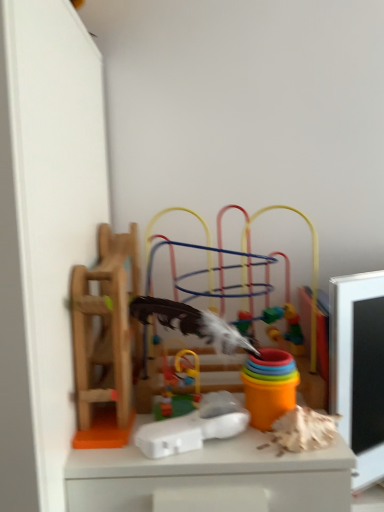
Image resolution: width=384 pixels, height=512 pixels. Describe the element at coordinates (194, 426) in the screenshot. I see `white plastic toy at center, which ranks as the third toy in left-to-right order` at that location.

Where is `white plastic toy at center, which ranks as the third toy in left-to-right order`? This screenshot has height=512, width=384. white plastic toy at center, which ranks as the third toy in left-to-right order is located at coordinates (194, 426).

Is rubberized plastic toy at center, which is the third toy from right to left, not near multicolored plastic toy at center, the first toy viewed from the right?

No, there isn't a large distance between rubberized plastic toy at center, which is the third toy from right to left, and multicolored plastic toy at center, the first toy viewed from the right.

Is rubberized plastic toy at center, which is the third toy from right to left, facing away from multicolored plastic toy at center, the first toy viewed from the right?

Yes, rubberized plastic toy at center, which is the third toy from right to left, is positioned with its back facing multicolored plastic toy at center, the first toy viewed from the right.

Which of these two, rubberized plastic toy at center, which is the third toy from right to left, or multicolored plastic toy at center, the first toy viewed from the right, is wider?

multicolored plastic toy at center, the first toy viewed from the right.

Who is more distant, rubberized plastic toy at center, which is the third toy from right to left, or multicolored plastic toy at center, acting as the 4th toy starting from the left?

multicolored plastic toy at center, acting as the 4th toy starting from the left, is further from the camera.

From the image's perspective, which is below, white plastic toy at center, which ranks as the 2th toy in right-to-left order, or multicolored plastic toy at center, acting as the 4th toy starting from the left?

white plastic toy at center, which ranks as the 2th toy in right-to-left order.

Can you confirm if white plastic toy at center, which ranks as the 2th toy in right-to-left order, is smaller than multicolored plastic toy at center, acting as the 4th toy starting from the left?

Correct, white plastic toy at center, which ranks as the 2th toy in right-to-left order, occupies less space than multicolored plastic toy at center, acting as the 4th toy starting from the left.

You are a GUI agent. You are given a task and a screenshot of the screen. Output one action in this format:
    pyautogui.click(x=<x>, y=<y>)
    Task: Click on the toy on the right of white plastic toy at center, which ranks as the 2th toy in right-to-left order
    The image size is (384, 512).
    Given the screenshot: What is the action you would take?
    pyautogui.click(x=106, y=342)

Is white plastic toy at center, which ranks as the third toy in left-to-right order, closer to the viewer compared to multicolored plastic toy at center, the first toy viewed from the right?

That is True.

You are a GUI agent. You are given a task and a screenshot of the screen. Output one action in this format:
    pyautogui.click(x=<x>, y=<y>)
    Task: Click on the toy located in front of the wooden ladder at left, which is the fourth toy from right to left
    Image resolution: width=384 pixels, height=512 pixels.
    Given the screenshot: What is the action you would take?
    pyautogui.click(x=194, y=426)

Would you say wooden ladder at left, placed as the 1th toy when sorted from left to right, is outside white plastic toy at center, which ranks as the third toy in left-to-right order?

Absolutely, wooden ladder at left, placed as the 1th toy when sorted from left to right, is external to white plastic toy at center, which ranks as the third toy in left-to-right order.

How many degrees apart are the facing directions of wooden ladder at left, placed as the 1th toy when sorted from left to right, and white plastic toy at center, which ranks as the third toy in left-to-right order?

The angular difference between wooden ladder at left, placed as the 1th toy when sorted from left to right, and white plastic toy at center, which ranks as the third toy in left-to-right order, is 17.5 degrees.

Which is more to the right, wooden ladder at left, placed as the 1th toy when sorted from left to right, or white plastic toy at center, which ranks as the third toy in left-to-right order?

white plastic toy at center, which ranks as the third toy in left-to-right order.

Who is smaller, multicolored plastic toy at center, the first toy viewed from the right, or rubberized plastic toy at center, which appears as the 2th toy when viewed from the left?

With smaller size is rubberized plastic toy at center, which appears as the 2th toy when viewed from the left.

This screenshot has height=512, width=384. In order to click on the 2nd toy below the multicolored plastic toy at center, the first toy viewed from the right (from the image's perspective) in this screenshot , I will do `click(179, 386)`.

Is multicolored plastic toy at center, the first toy viewed from the right, oriented away from rubberized plastic toy at center, which is the third toy from right to left?

That's not correct — multicolored plastic toy at center, the first toy viewed from the right, is not looking away from rubberized plastic toy at center, which is the third toy from right to left.

Is multicolored plastic toy at center, acting as the 4th toy starting from the left, surrounding rubberized plastic toy at center, which appears as the 2th toy when viewed from the left?

No.

You are a GUI agent. You are given a task and a screenshot of the screen. Output one action in this format:
    pyautogui.click(x=<x>, y=<y>)
    Task: Click on the 2nd toy behind when counting from the wooden ladder at left, which is the fourth toy from right to left
    The width and height of the screenshot is (384, 512).
    Given the screenshot: What is the action you would take?
    pyautogui.click(x=106, y=342)

Between wooden ladder at left, which is the fourth toy from right to left, and multicolored plastic toy at center, acting as the 4th toy starting from the left, which one has more height?

multicolored plastic toy at center, acting as the 4th toy starting from the left, is taller.

Can you confirm if wooden ladder at left, placed as the 1th toy when sorted from left to right, is bigger than multicolored plastic toy at center, the first toy viewed from the right?

No.

Do you think wooden ladder at left, placed as the 1th toy when sorted from left to right, is within multicolored plastic toy at center, acting as the 4th toy starting from the left, or outside of it?

wooden ladder at left, placed as the 1th toy when sorted from left to right, lies outside multicolored plastic toy at center, acting as the 4th toy starting from the left.

Could you measure the distance between white plastic toy at center, which ranks as the third toy in left-to-right order, and rubberized plastic toy at center, which appears as the 2th toy when viewed from the left?

A distance of 1.85 inches exists between white plastic toy at center, which ranks as the third toy in left-to-right order, and rubberized plastic toy at center, which appears as the 2th toy when viewed from the left.

From the image's perspective, between white plastic toy at center, which ranks as the third toy in left-to-right order, and rubberized plastic toy at center, which is the third toy from right to left, which one is located above?

rubberized plastic toy at center, which is the third toy from right to left, from the image's perspective.

Considering the sizes of objects white plastic toy at center, which ranks as the 2th toy in right-to-left order, and rubberized plastic toy at center, which is the third toy from right to left, in the image provided, who is smaller, white plastic toy at center, which ranks as the 2th toy in right-to-left order, or rubberized plastic toy at center, which is the third toy from right to left,?

white plastic toy at center, which ranks as the 2th toy in right-to-left order, is smaller.

Is white plastic toy at center, which ranks as the 2th toy in right-to-left order, in front of or behind rubberized plastic toy at center, which appears as the 2th toy when viewed from the left, in the image?

Clearly, white plastic toy at center, which ranks as the 2th toy in right-to-left order, is in front of rubberized plastic toy at center, which appears as the 2th toy when viewed from the left.

What's the angular difference between multicolored plastic toy at center, the first toy viewed from the right, and white plastic toy at center, which ranks as the third toy in left-to-right order,'s facing directions?

The facing directions of multicolored plastic toy at center, the first toy viewed from the right, and white plastic toy at center, which ranks as the third toy in left-to-right order, are 17.5 degrees apart.

Are multicolored plastic toy at center, the first toy viewed from the right, and white plastic toy at center, which ranks as the third toy in left-to-right order, located far from each other?

That's not correct — multicolored plastic toy at center, the first toy viewed from the right, is a little close to white plastic toy at center, which ranks as the third toy in left-to-right order.

Locate an element on the screen. The image size is (384, 512). the 3rd toy positioned below the multicolored plastic toy at center, acting as the 4th toy starting from the left (from a real-world perspective) is located at coordinates (194, 426).

Who is smaller, multicolored plastic toy at center, acting as the 4th toy starting from the left, or white plastic toy at center, which ranks as the third toy in left-to-right order?

white plastic toy at center, which ranks as the third toy in left-to-right order, is smaller.

You are a GUI agent. You are given a task and a screenshot of the screen. Output one action in this format:
    pyautogui.click(x=<x>, y=<y>)
    Task: Click on the toy behind the rubberized plastic toy at center, which appears as the 2th toy when viewed from the left
    
    Given the screenshot: What is the action you would take?
    pyautogui.click(x=106, y=342)

This screenshot has height=512, width=384. I want to click on the 3rd toy in front of the multicolored plastic toy at center, the first toy viewed from the right, so click(194, 426).

Considering their positions, is rubberized plastic toy at center, which is the third toy from right to left, positioned closer to white plastic toy at center, which ranks as the 2th toy in right-to-left order, than wooden ladder at left, placed as the 1th toy when sorted from left to right?

rubberized plastic toy at center, which is the third toy from right to left, is closer to white plastic toy at center, which ranks as the 2th toy in right-to-left order.

Based on their spatial positions, is white plastic toy at center, which ranks as the 2th toy in right-to-left order, or multicolored plastic toy at center, the first toy viewed from the right, closer to rubberized plastic toy at center, which appears as the 2th toy when viewed from the left?

white plastic toy at center, which ranks as the 2th toy in right-to-left order, is positioned closer to the anchor rubberized plastic toy at center, which appears as the 2th toy when viewed from the left.

Estimate the real-world distances between objects in this image. Which object is closer to multicolored plastic toy at center, acting as the 4th toy starting from the left, white plastic toy at center, which ranks as the 2th toy in right-to-left order, or rubberized plastic toy at center, which is the third toy from right to left?

rubberized plastic toy at center, which is the third toy from right to left.

Based on their spatial positions, is multicolored plastic toy at center, acting as the 4th toy starting from the left, or white plastic toy at center, which ranks as the third toy in left-to-right order, further from rubberized plastic toy at center, which is the third toy from right to left?

The object further to rubberized plastic toy at center, which is the third toy from right to left, is multicolored plastic toy at center, acting as the 4th toy starting from the left.

When comparing their distances from white plastic toy at center, which ranks as the third toy in left-to-right order, does multicolored plastic toy at center, acting as the 4th toy starting from the left, or wooden ladder at left, placed as the 1th toy when sorted from left to right, seem closer?

wooden ladder at left, placed as the 1th toy when sorted from left to right.

Looking at the image, which one is located closer to rubberized plastic toy at center, which appears as the 2th toy when viewed from the left, wooden ladder at left, placed as the 1th toy when sorted from left to right, or multicolored plastic toy at center, the first toy viewed from the right?

wooden ladder at left, placed as the 1th toy when sorted from left to right.

Based on their spatial positions, is multicolored plastic toy at center, the first toy viewed from the right, or rubberized plastic toy at center, which is the third toy from right to left, further from wooden ladder at left, which is the fourth toy from right to left?

rubberized plastic toy at center, which is the third toy from right to left, is further to wooden ladder at left, which is the fourth toy from right to left.

Based on their spatial positions, is wooden ladder at left, placed as the 1th toy when sorted from left to right, or rubberized plastic toy at center, which is the third toy from right to left, closer to white plastic toy at center, which ranks as the 2th toy in right-to-left order?

Among the two, rubberized plastic toy at center, which is the third toy from right to left, is located nearer to white plastic toy at center, which ranks as the 2th toy in right-to-left order.

Identify the location of toy that lies between wooden ladder at left, placed as the 1th toy when sorted from left to right, and white plastic toy at center, which ranks as the 2th toy in right-to-left order, from top to bottom. (179, 386).